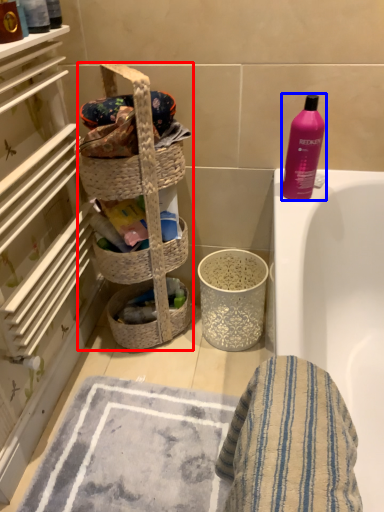
Question: Which object is further to the camera taking this photo, laundry basket (highlighted by a red box) or bottle (highlighted by a blue box)?

Choices:
 (A) laundry basket
 (B) bottle

Answer: (B)